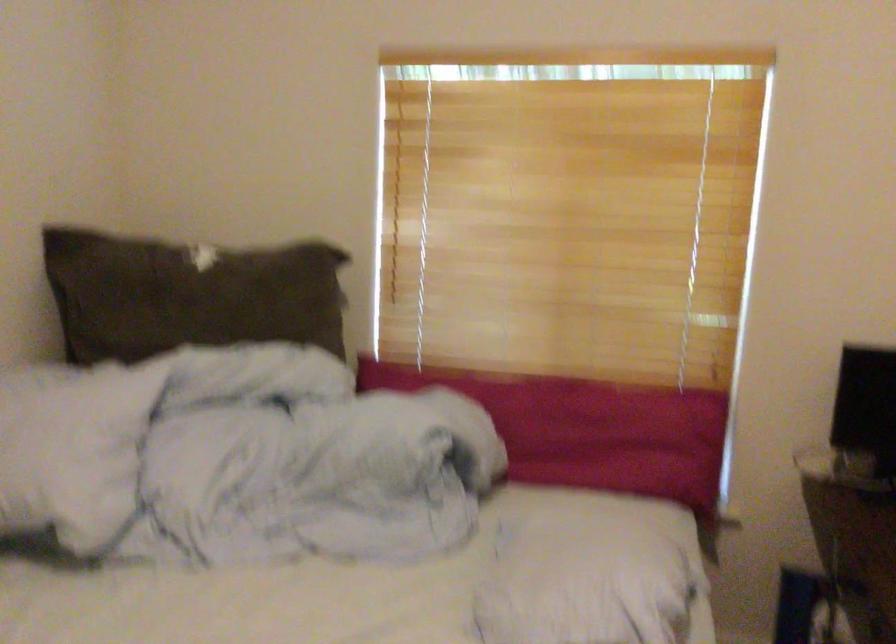
Question: How did the camera likely rotate?

Choices:
 (A) Left
 (B) Right
 (C) Up
 (D) Down

Answer: (B)